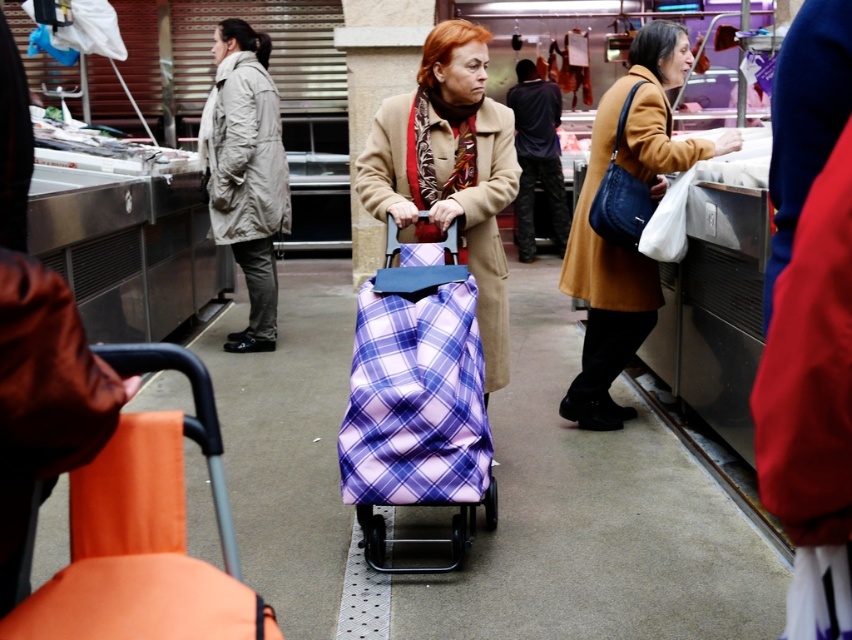
Question: Is plaid fabric stroller at center thinner than brown wool coat at center?

Choices:
 (A) yes
 (B) no

Answer: (A)

Question: Which is farther from the matte blue leather bag at right?

Choices:
 (A) light beige coat at left
 (B) brown wool coat at center

Answer: (A)

Question: Estimate the real-world distances between objects in this image. Which object is closer to the brown wool coat at center?

Choices:
 (A) plaid fabric bag at center
 (B) matte blue leather bag at right
 (C) light beige coat at left

Answer: (B)

Question: Which object is closer to the camera taking this photo?

Choices:
 (A) light beige coat at left
 (B) plaid fabric bag at center
 (C) plaid fabric stroller at center
 (D) brown wool coat at center

Answer: (B)

Question: Does light beige coat at left have a lesser width compared to matte blue leather bag at right?

Choices:
 (A) no
 (B) yes

Answer: (A)

Question: Can you confirm if plaid fabric bag at center is positioned to the left of brown wool coat at center?

Choices:
 (A) yes
 (B) no

Answer: (A)